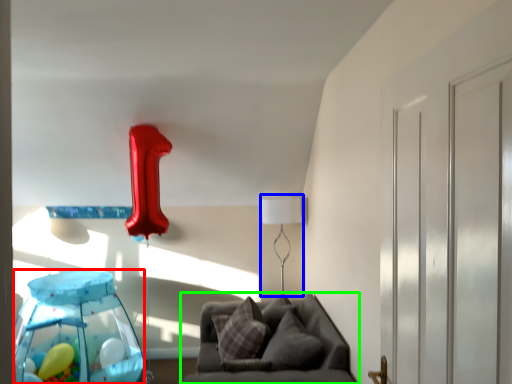
Question: Which is nearer to the glass table (highlighted by a red box)? table lamp (highlighted by a blue box) or furniture (highlighted by a green box).

Choices:
 (A) table lamp
 (B) furniture

Answer: (B)